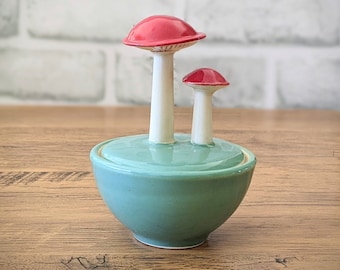
This screenshot has height=270, width=340. In order to click on white bricked wall in this screenshot , I will do pos(84,18), pos(311,67), pos(261,70), pos(266,24), pos(40,77), pos(7,15).